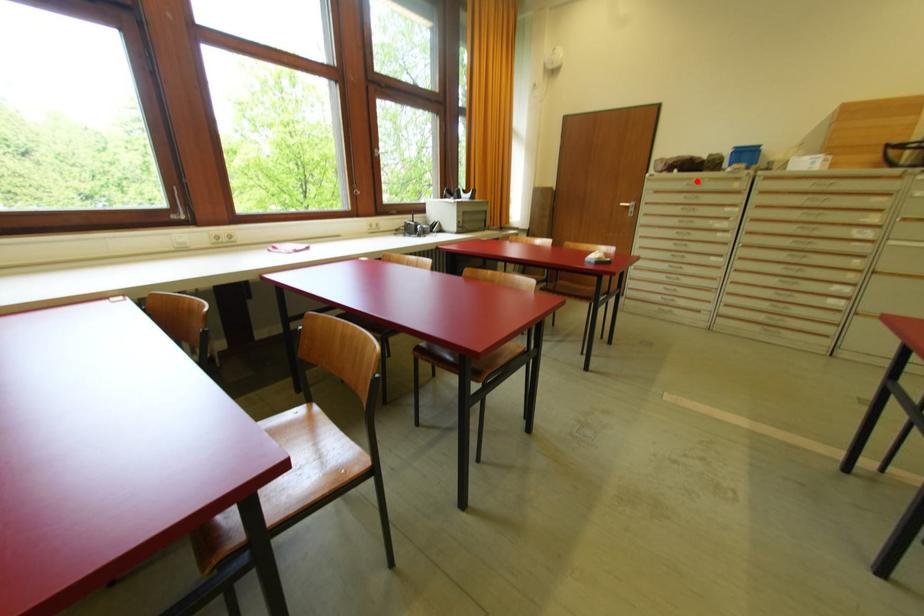
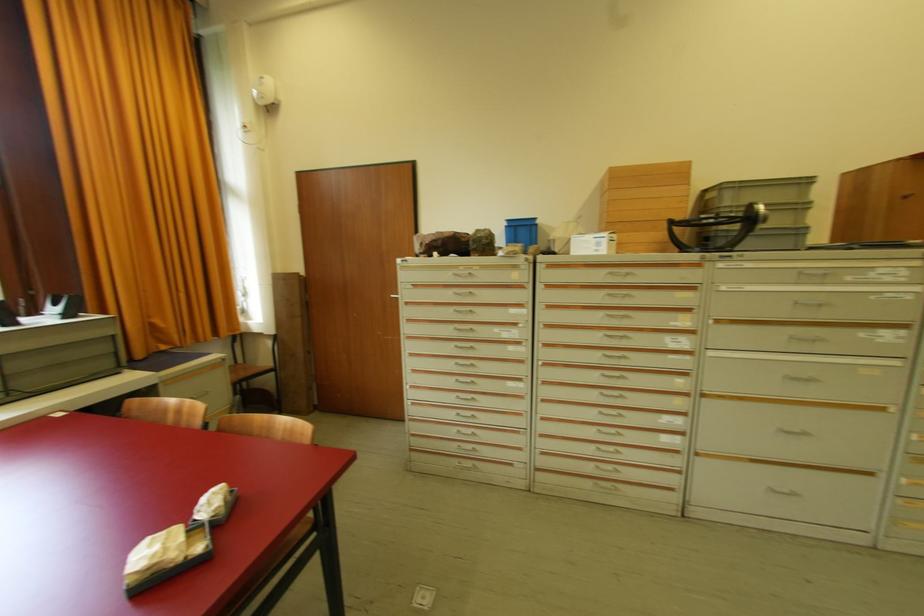
Find the pixel in the second image that matches the highlighted location in the first image.

(464, 270)